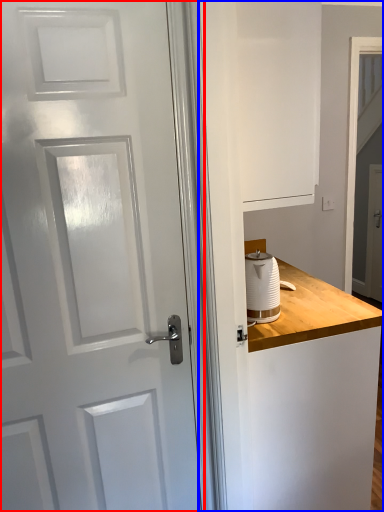
Question: Among these objects, which one is farthest to the camera, door (highlighted by a red box) or dresser (highlighted by a blue box)?

Choices:
 (A) door
 (B) dresser

Answer: (A)